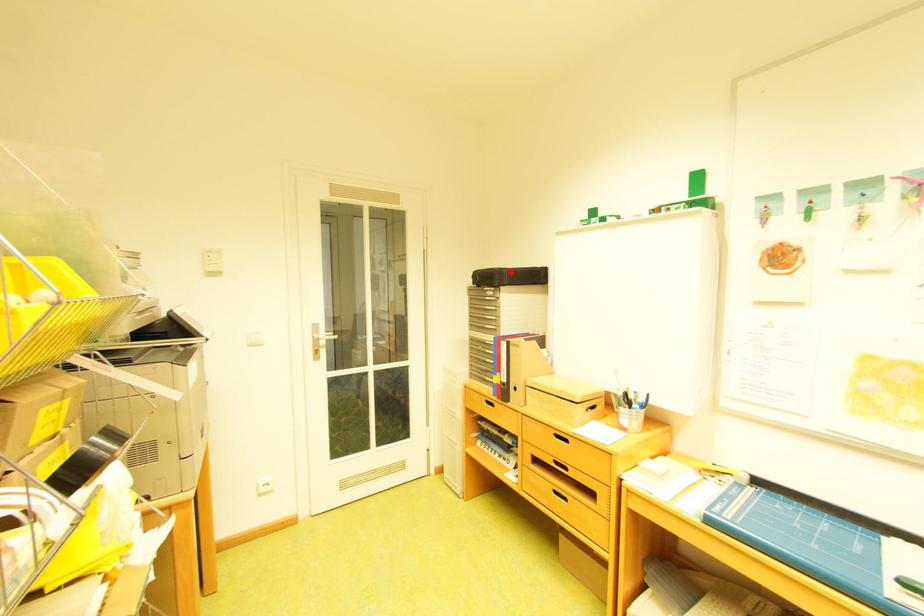
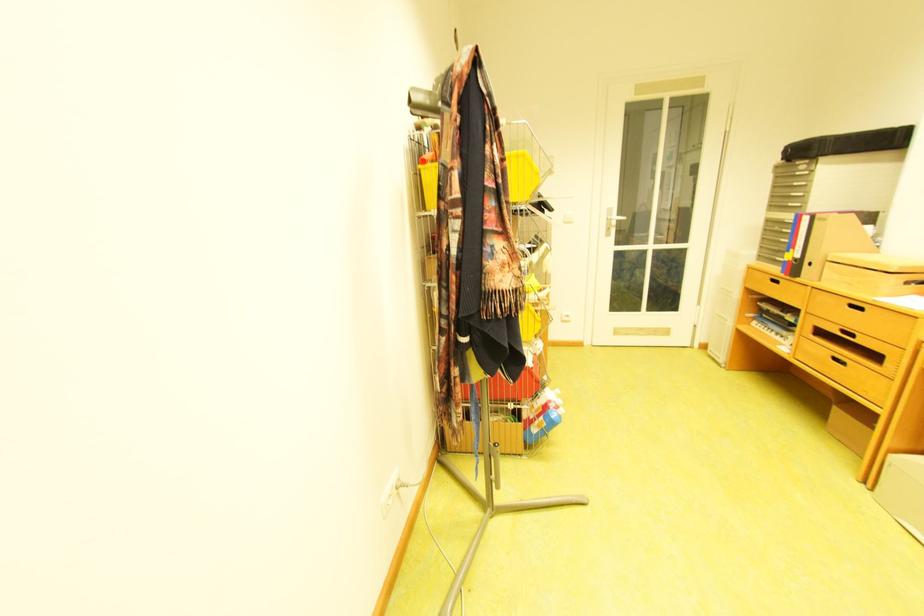
Question: I am providing you with two images of the same scene from different viewpoints. A red point is shown in image1. For the corresponding object point in image2, is it positioned nearer or farther from the camera?

Choices:
 (A) Nearer
 (B) Farther

Answer: (B)